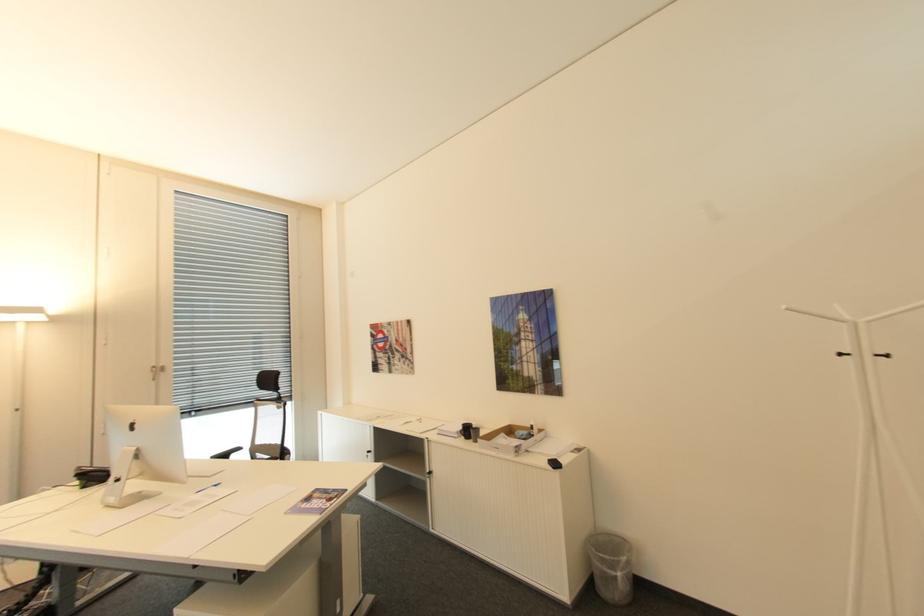
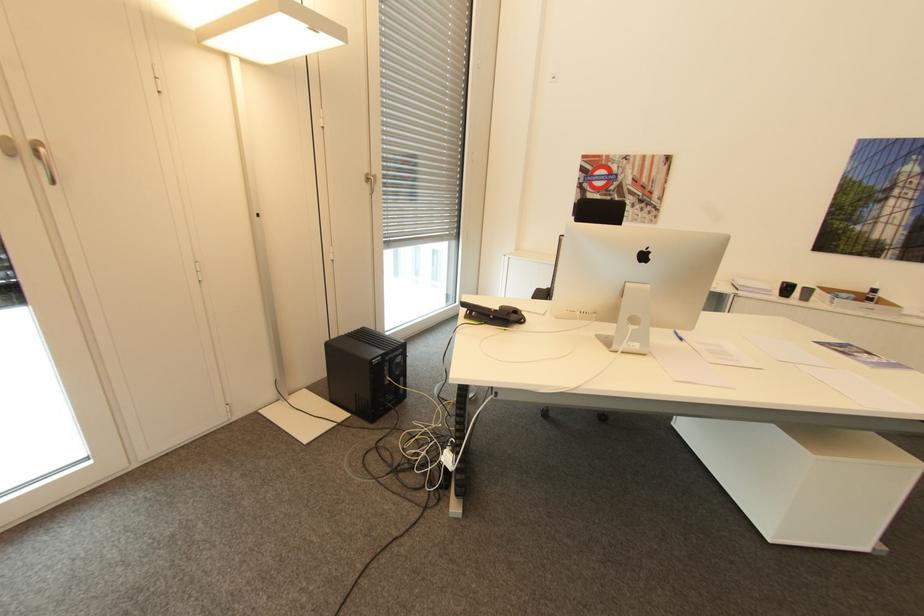
In the second image, find the point that corresponds to pixel 468 424 in the first image.

(788, 283)